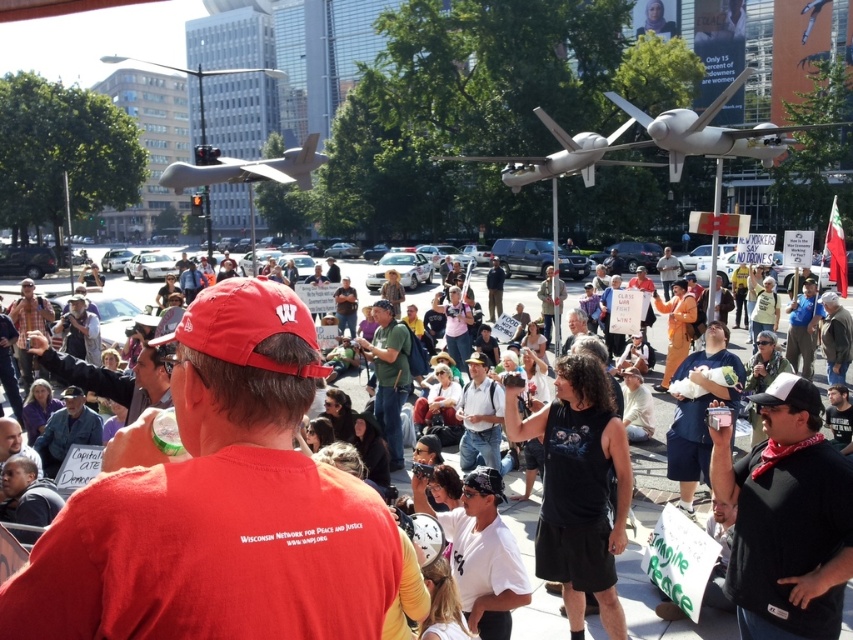
Question: Estimate the real-world distances between objects in this image. Which object is farther from the matte black crowd at center?

Choices:
 (A) white matte drone at upper center
 (B) matte gray drone at center

Answer: (A)

Question: Which point is closer to the camera?

Choices:
 (A) white matte drone at upper center
 (B) matte black crowd at center
 (C) matte gray drone at center

Answer: (B)

Question: Which is nearer to the matte gray drone at center?

Choices:
 (A) white matte drone at upper center
 (B) matte black crowd at center

Answer: (B)

Question: Does white matte drone at upper center appear on the right side of matte gray drone at center?

Choices:
 (A) no
 (B) yes

Answer: (B)

Question: Where is white matte drone at upper center located in relation to matte gray drone at center in the image?

Choices:
 (A) left
 (B) right

Answer: (B)

Question: Can you confirm if matte gray drone at center is bigger than matte black crowd at center?

Choices:
 (A) no
 (B) yes

Answer: (B)